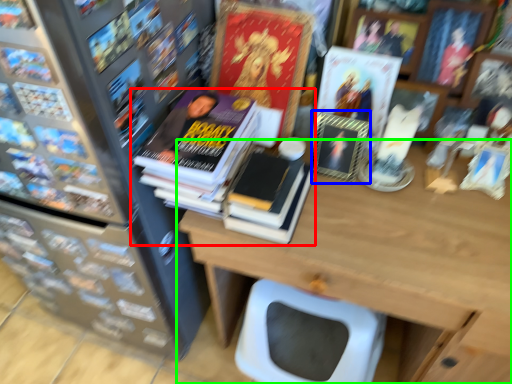
Question: Considering the real-world distances, which object is farthest from book (highlighted by a red box)? book cover (highlighted by a blue box) or table (highlighted by a green box)?

Choices:
 (A) book cover
 (B) table

Answer: (B)